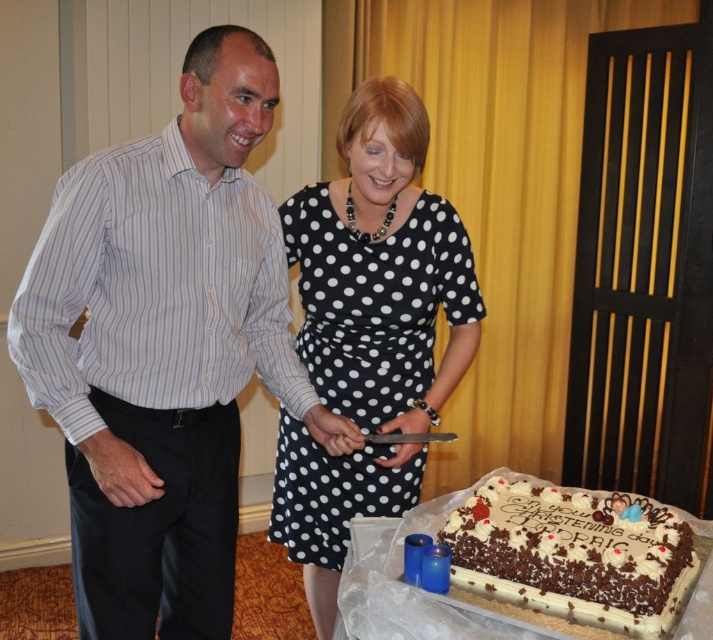
Question: Which of the following is the farthest from the observer?

Choices:
 (A) (636, 636)
 (B) (409, 228)
 (C) (165, 160)

Answer: (B)

Question: Is white striped shirt at left bigger than black dotted dress at center?

Choices:
 (A) yes
 (B) no

Answer: (B)

Question: Is white striped shirt at left smaller than white frosted chocolate cake at lower right?

Choices:
 (A) no
 (B) yes

Answer: (A)

Question: Which point is closer to the camera?

Choices:
 (A) white striped shirt at left
 (B) black dotted dress at center

Answer: (A)

Question: Does white striped shirt at left come behind white frosted chocolate cake at lower right?

Choices:
 (A) no
 (B) yes

Answer: (B)

Question: Considering the real-world distances, which object is farthest from the white frosted chocolate cake at lower right?

Choices:
 (A) black dotted dress at center
 (B) white striped shirt at left

Answer: (B)